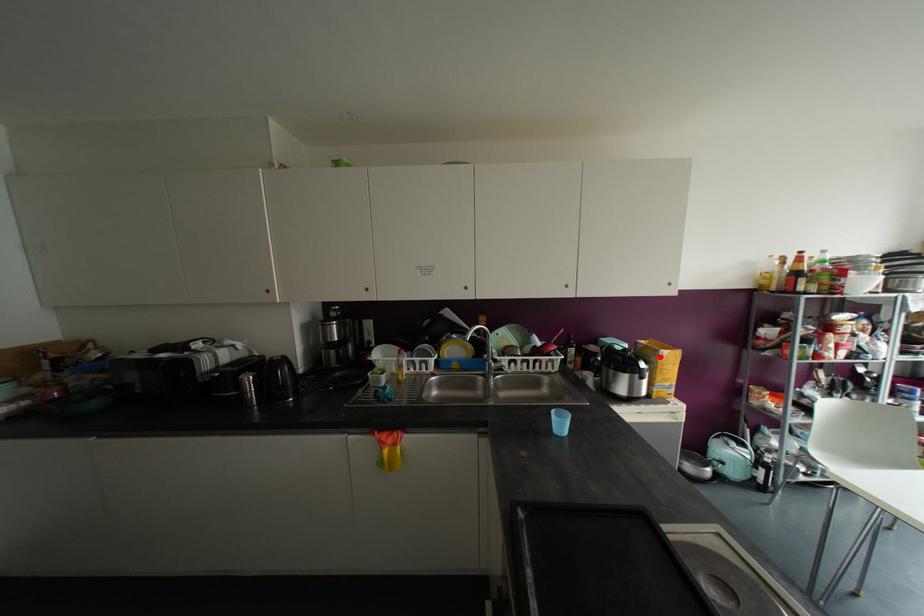
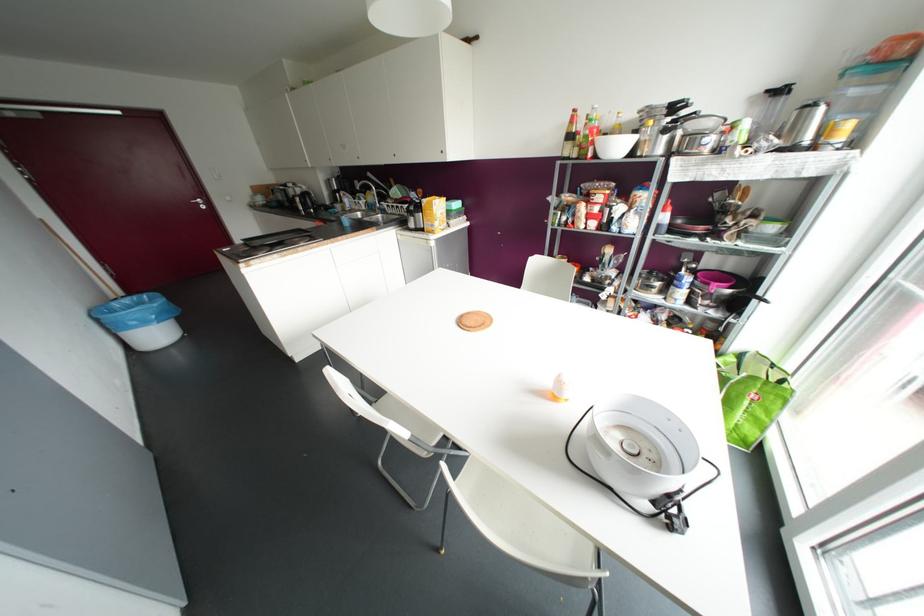
Question: I am providing you with two images of the same scene from different viewpoints. In image1, a red point is highlighted. Considering the same 3D point in image2, which of the following is correct?

Choices:
 (A) It is closer
 (B) It is farther

Answer: (A)